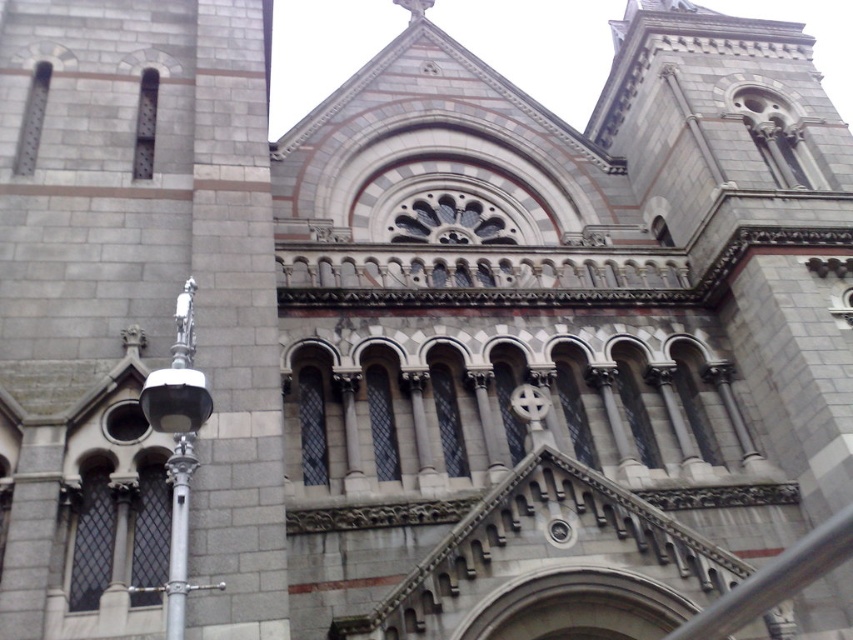
Question: Does silver metallic streetlight at left appear over metallic gray rail at lower right?

Choices:
 (A) no
 (B) yes

Answer: (B)

Question: Is silver metallic streetlight at left to the left of silver metallic pole at left from the viewer's perspective?

Choices:
 (A) no
 (B) yes

Answer: (B)

Question: From the image, what is the correct spatial relationship of silver metallic streetlight at left in relation to metallic gray rail at lower right?

Choices:
 (A) above
 (B) below

Answer: (A)

Question: Which point is closer to the camera?

Choices:
 (A) (761, 605)
 (B) (173, 554)
 (C) (173, 506)

Answer: (B)

Question: Which object is the farthest from the metallic gray rail at lower right?

Choices:
 (A) silver metallic streetlight at left
 (B) silver metallic pole at left

Answer: (B)

Question: Based on their relative distances, which object is nearer to the metallic gray rail at lower right?

Choices:
 (A) silver metallic pole at left
 (B) silver metallic streetlight at left

Answer: (B)